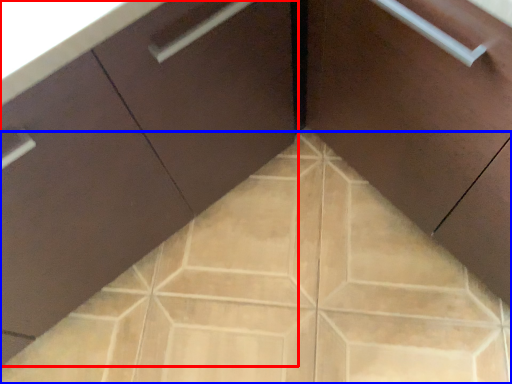
Question: Among these objects, which one is nearest to the camera, cabinetry (highlighted by a red box) or ceramic tile (highlighted by a blue box)?

Choices:
 (A) cabinetry
 (B) ceramic tile

Answer: (A)